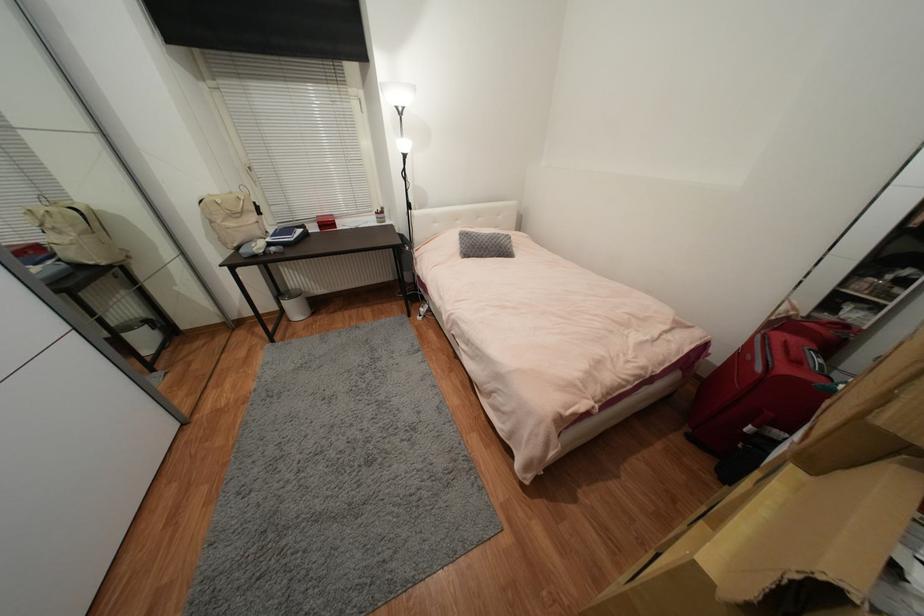
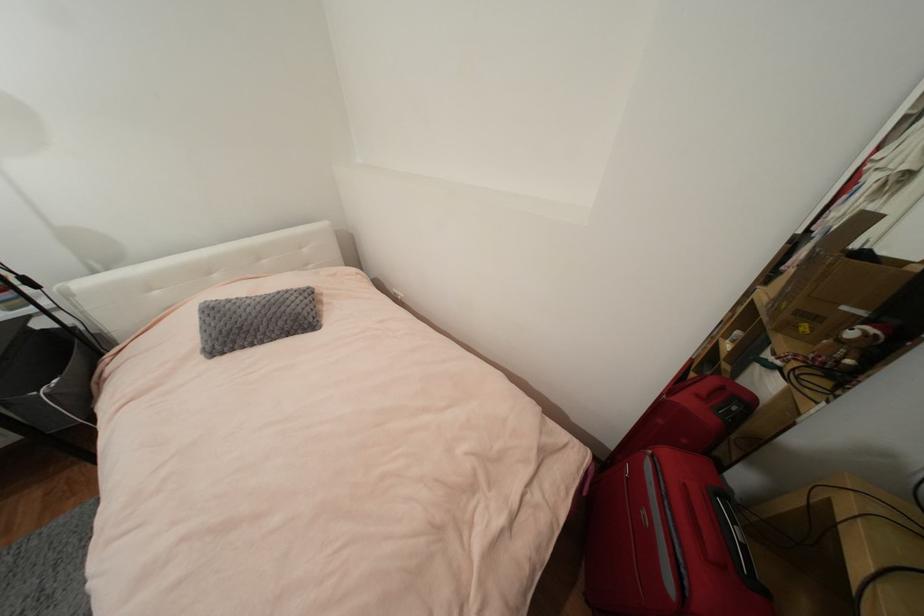
The images are taken continuously from a first-person perspective. In which direction are you moving?

The cameraman moved toward right, forward.